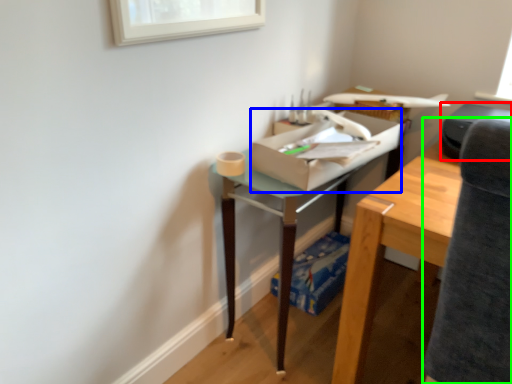
Question: Which object is positioned closest to printer (highlighted by a red box)? Select from cardboard box (highlighted by a blue box) and swivel chair (highlighted by a green box).

Choices:
 (A) cardboard box
 (B) swivel chair

Answer: (A)